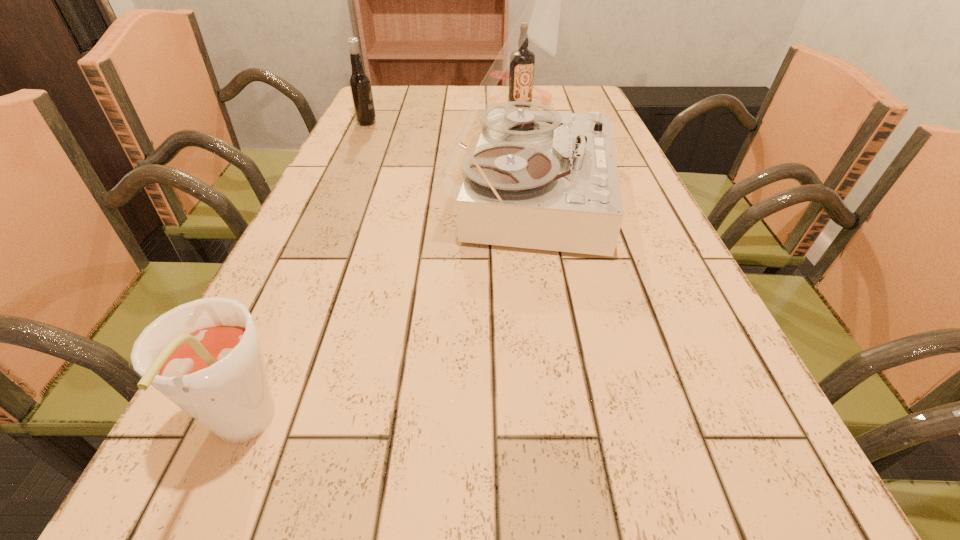
This screenshot has width=960, height=540. I want to click on record player positioned at the right edge, so click(x=543, y=180).

Find the location of a particular element. root beer located at the right edge is located at coordinates (521, 74).

Locate an element on the screen. object located at the far right corner is located at coordinates (521, 74).

The image size is (960, 540). Identify the location of vacant space at the left edge of the desktop. (334, 188).

You are a GUI agent. You are given a task and a screenshot of the screen. Output one action in this format:
    pyautogui.click(x=<x>, y=<y>)
    Task: Click on the vacant region at the right edge
    
    Given the screenshot: What is the action you would take?
    pyautogui.click(x=800, y=488)

The height and width of the screenshot is (540, 960). I want to click on vacant region between the nearest root beer and the tallest object, so click(385, 312).

Image resolution: width=960 pixels, height=540 pixels. Find the location of `vacant point located between the nearest object and the third nearest object`. vacant point located between the nearest object and the third nearest object is located at coordinates (303, 277).

At what (x,y) coordinates should I click in order to perform the action: click on unoccupied area between the nearest root beer and the record player. Please return your answer as a coordinate pair (x, y). The image size is (960, 540). Looking at the image, I should click on (385, 312).

Identify the location of vacant area that lies between the second farthest root beer and the farthest root beer. (444, 114).

At what (x,y) coordinates should I click in order to perform the action: click on vacant space in between the nearest object and the second nearest object. Please return your answer as a coordinate pair (x, y). The image size is (960, 540). Looking at the image, I should click on (385, 312).